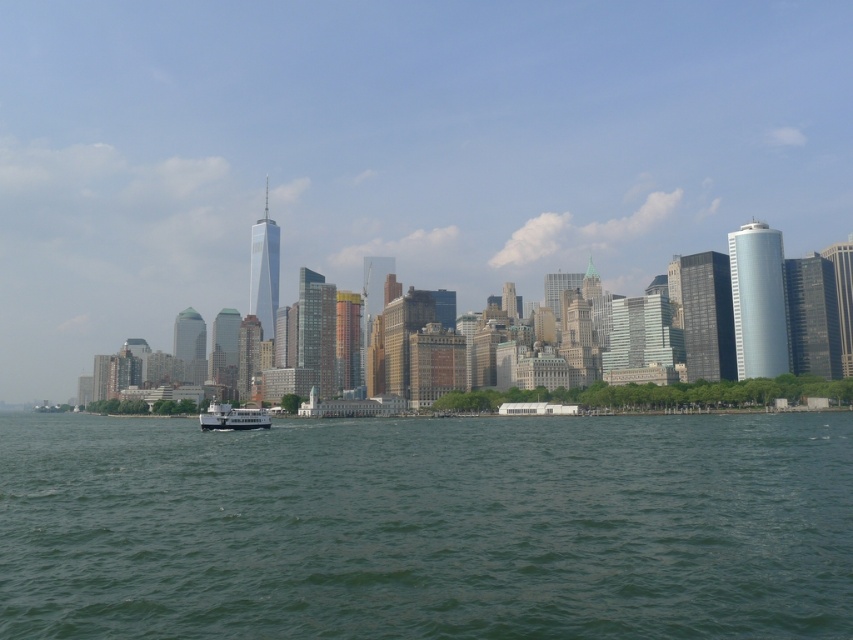
Question: Is green water at center above white glossy ferry at center?

Choices:
 (A) yes
 (B) no

Answer: (A)

Question: Which point is closer to the camera?

Choices:
 (A) (259, 419)
 (B) (254, 451)

Answer: (B)

Question: Is green water at center above white glossy ferry at center?

Choices:
 (A) no
 (B) yes

Answer: (B)

Question: Does green water at center lie in front of white glossy ferry at center?

Choices:
 (A) yes
 (B) no

Answer: (A)